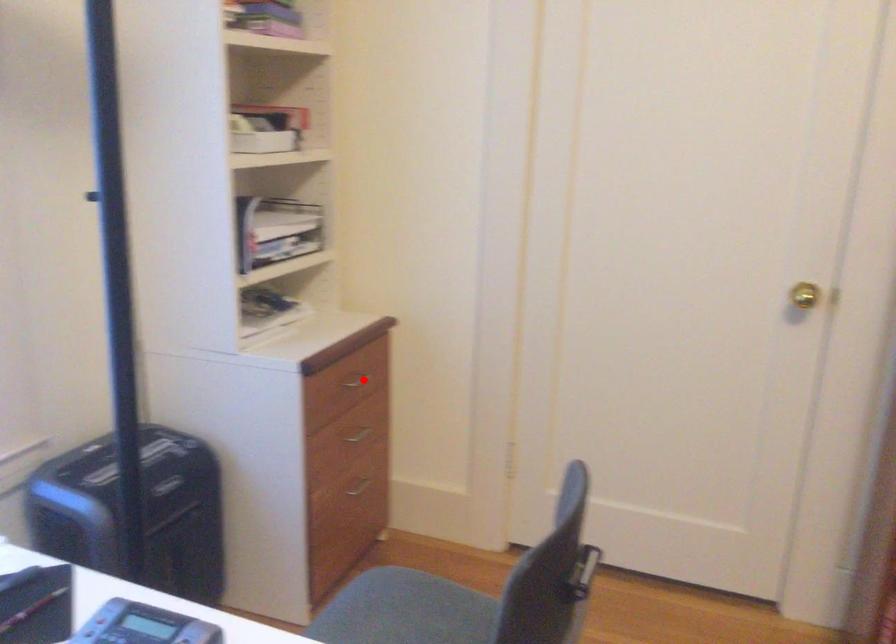
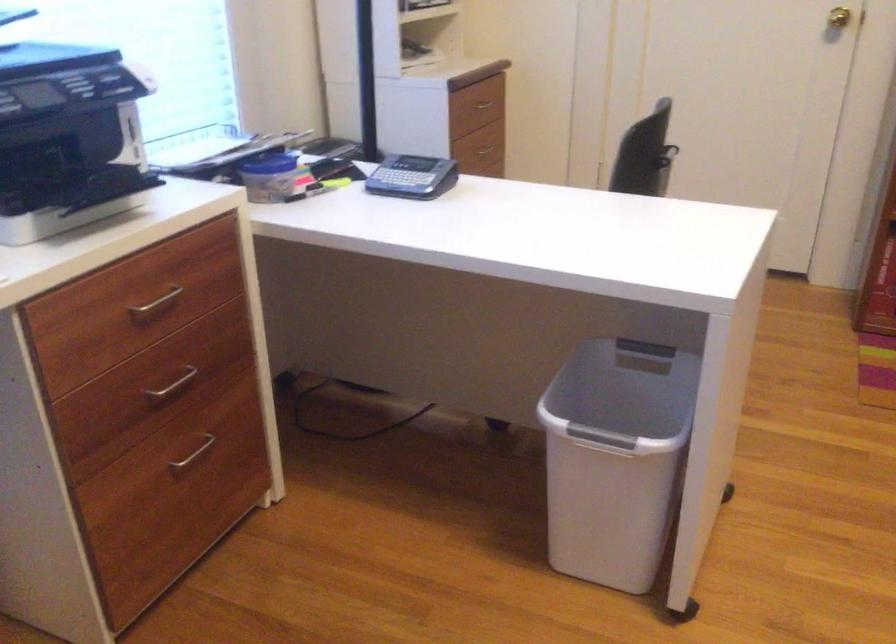
Question: A red point is marked in image1. In image2, is the corresponding 3D point closer to the camera or farther? Reply with the corresponding letter.

Choices:
 (A) The corresponding 3D point is closer.
 (B) The corresponding 3D point is farther.

Answer: (B)